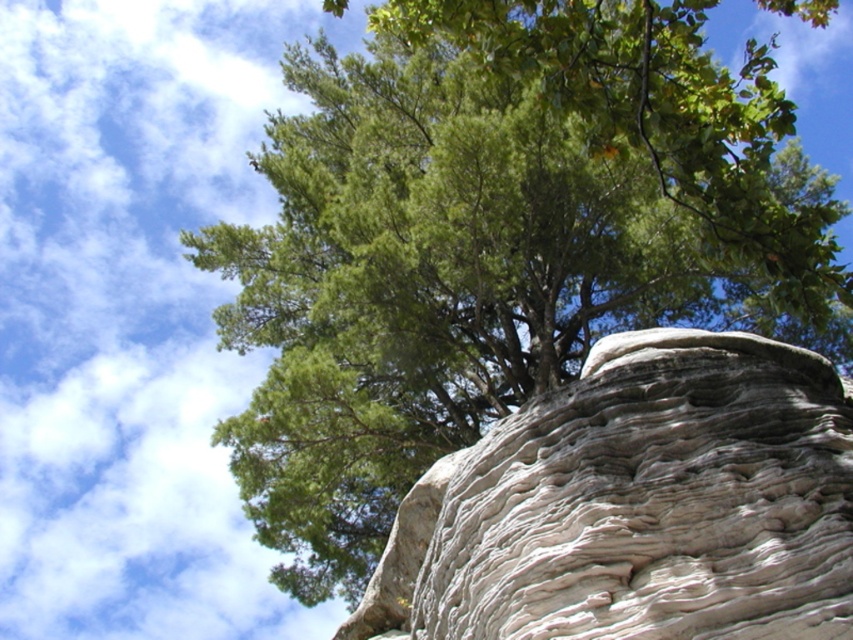
Question: Which point is farther from the camera taking this photo?

Choices:
 (A) (706, 205)
 (B) (387, 620)

Answer: (B)

Question: Is white textured rock at center further to the viewer compared to green leafy tree at upper center?

Choices:
 (A) no
 (B) yes

Answer: (A)

Question: Which point is farther to the camera?

Choices:
 (A) green leafy tree at upper center
 (B) white textured rock at center

Answer: (A)

Question: Is white textured rock at center to the left of green leafy tree at upper center from the viewer's perspective?

Choices:
 (A) yes
 (B) no

Answer: (A)

Question: Observing the image, what is the correct spatial positioning of white textured rock at center in reference to green leafy tree at upper center?

Choices:
 (A) below
 (B) above

Answer: (A)